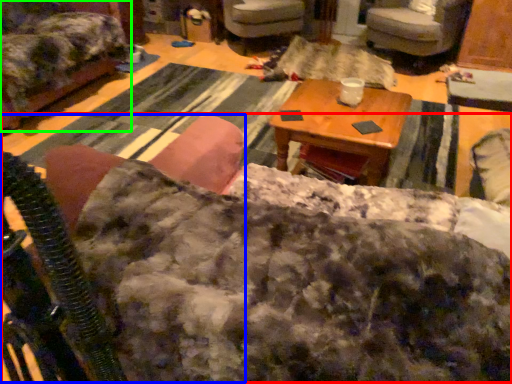
Question: Which is farther away from couch (highlighted by a red box)? rocking chair (highlighted by a blue box) or chair (highlighted by a green box)?

Choices:
 (A) rocking chair
 (B) chair

Answer: (B)